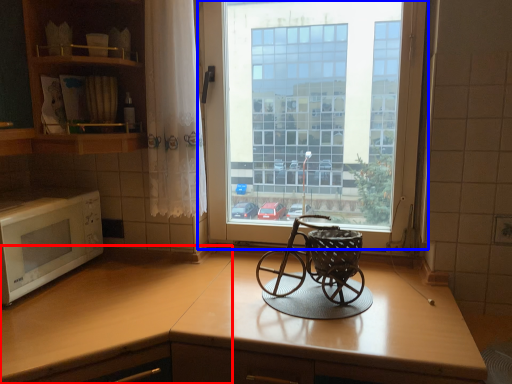
Question: Which object appears closest to the camera in this image, counter top (highlighted by a red box) or window (highlighted by a blue box)?

Choices:
 (A) counter top
 (B) window

Answer: (A)